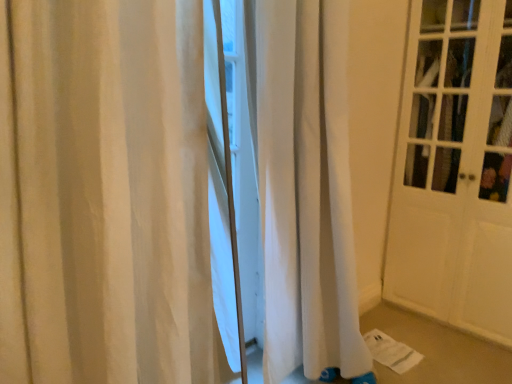
Question: In terms of width, does white wood door at right look wider or thinner when compared to white fabric curtain at center?

Choices:
 (A) thin
 (B) wide

Answer: (B)

Question: From the image's perspective, is white wood door at right located above or below white fabric curtain at center?

Choices:
 (A) above
 (B) below

Answer: (A)

Question: Considering the positions of white wood door at right and white fabric curtain at center in the image, is white wood door at right taller or shorter than white fabric curtain at center?

Choices:
 (A) short
 (B) tall

Answer: (B)

Question: Is white fabric curtain at center bigger or smaller than white wood door at right?

Choices:
 (A) big
 (B) small

Answer: (B)

Question: Is point (189, 347) closer or farther from the camera than point (493, 172)?

Choices:
 (A) farther
 (B) closer

Answer: (B)

Question: From a real-world perspective, is white fabric curtain at center positioned above or below white wood door at right?

Choices:
 (A) above
 (B) below

Answer: (B)

Question: From the image's perspective, is white fabric curtain at center positioned above or below white wood door at right?

Choices:
 (A) below
 (B) above

Answer: (A)